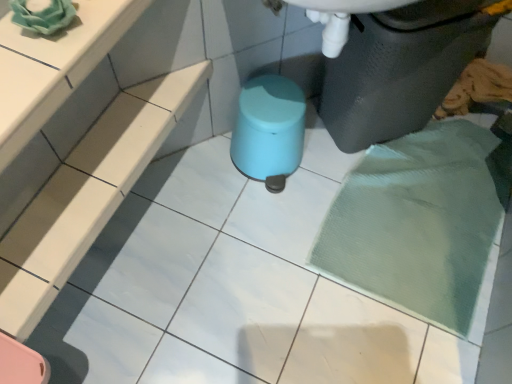
The image size is (512, 384). Identify the location of free point above mint glossy stool at center (from a real-world perspective). (266, 105).